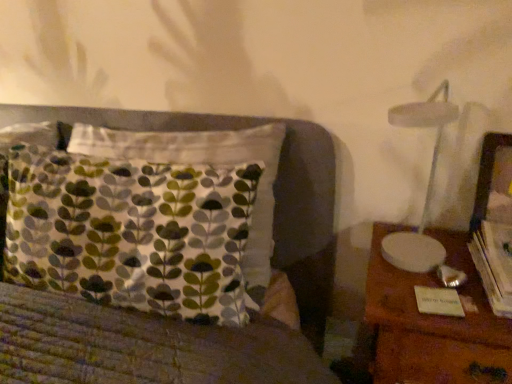
Find the location of a particular element. The image size is (512, 384). wooden nightstand at right is located at coordinates (434, 323).

Can you confirm if wooden nightstand at right is positioned to the right of hardcover book at right?

Incorrect, wooden nightstand at right is not on the right side of hardcover book at right.

From the image's perspective, between wooden nightstand at right and hardcover book at right, which one is located above?

hardcover book at right is shown above in the image.

Is wooden nightstand at right wider or thinner than hardcover book at right?

Clearly, wooden nightstand at right has more width compared to hardcover book at right.

Is point (430, 364) positioned before point (474, 237)?

Yes, it is in front of point (474, 237).

From the image's perspective, who appears lower, wooden nightstand at right or wooden picture frame at right?

wooden nightstand at right is shown below in the image.

Can you confirm if wooden nightstand at right is shorter than wooden picture frame at right?

In fact, wooden nightstand at right may be taller than wooden picture frame at right.

Could you tell me if wooden nightstand at right is facing wooden picture frame at right?

No, wooden nightstand at right is not facing towards wooden picture frame at right.

From a real-world perspective, who is located lower, wooden nightstand at right or wooden picture frame at right?

From a 3D spatial view, wooden nightstand at right is below.

Looking at their sizes, would you say wooden picture frame at right is wider or thinner than hardcover book at right?

In the image, wooden picture frame at right appears to be more narrow than hardcover book at right.

Is wooden picture frame at right shorter than hardcover book at right?

Incorrect, the height of wooden picture frame at right does not fall short of that of hardcover book at right.

Does point (506, 162) lie in front of point (490, 240)?

No, it is not.

From the image's perspective, is wooden picture frame at right above or below hardcover book at right?

Clearly, from the image's perspective, wooden picture frame at right is above hardcover book at right.

Considering the relative positions of hardcover book at right and wooden picture frame at right in the image provided, is hardcover book at right to the right of wooden picture frame at right from the viewer's perspective?

No.

Is point (494, 236) positioned after point (484, 189)?

No, (494, 236) is closer to viewer.

Locate an element on the screen. The image size is (512, 384). picture frame lying above the hardcover book at right (from the image's perspective) is located at coordinates (493, 182).

Is hardcover book at right inside or outside of wooden picture frame at right?

hardcover book at right lies outside wooden picture frame at right.

Considering the sizes of objects wooden picture frame at right and wooden nightstand at right in the image provided, who is thinner, wooden picture frame at right or wooden nightstand at right?

Thinner between the two is wooden picture frame at right.

At what (x,y) coordinates should I click in order to perform the action: click on nightstand below the wooden picture frame at right (from the image's perspective). Please return your answer as a coordinate pair (x, y). This screenshot has width=512, height=384. Looking at the image, I should click on (434, 323).

From a real-world perspective, is wooden picture frame at right physically above wooden nightstand at right?

Correct, in the physical world, wooden picture frame at right is higher than wooden nightstand at right.

Is point (511, 237) closer to camera compared to point (407, 326)?

No.

Considering the relative positions of hardcover book at right and wooden nightstand at right in the image provided, is hardcover book at right to the left of wooden nightstand at right from the viewer's perspective?

No, hardcover book at right is not to the left of wooden nightstand at right.

From the image's perspective, which is above, hardcover book at right or wooden nightstand at right?

hardcover book at right, from the image's perspective.

Locate an element on the screen. book that is above the wooden nightstand at right (from a real-world perspective) is located at coordinates (494, 264).

What are the coordinates of `picture frame on the right of the wooden nightstand at right` in the screenshot? It's located at (493, 182).

Consider the image. Which object lies further to the anchor point hardcover book at right, wooden picture frame at right or wooden nightstand at right?

wooden nightstand at right is positioned further to the anchor hardcover book at right.

Based on their spatial positions, is wooden nightstand at right or hardcover book at right closer to wooden picture frame at right?

hardcover book at right is closer to wooden picture frame at right.

Considering their positions, is wooden nightstand at right positioned further to hardcover book at right than wooden picture frame at right?

wooden nightstand at right is positioned further to the anchor hardcover book at right.

Looking at the image, which one is located further to wooden nightstand at right, hardcover book at right or wooden picture frame at right?

wooden picture frame at right lies further to wooden nightstand at right than the other object.

Which object lies nearer to the anchor point wooden picture frame at right, hardcover book at right or wooden nightstand at right?

The object closer to wooden picture frame at right is hardcover book at right.

When comparing their distances from wooden nightstand at right, does wooden picture frame at right or hardcover book at right seem further?

wooden picture frame at right.

The image size is (512, 384). What are the coordinates of `book that lies between wooden picture frame at right and wooden nightstand at right from top to bottom` in the screenshot? It's located at (494, 264).